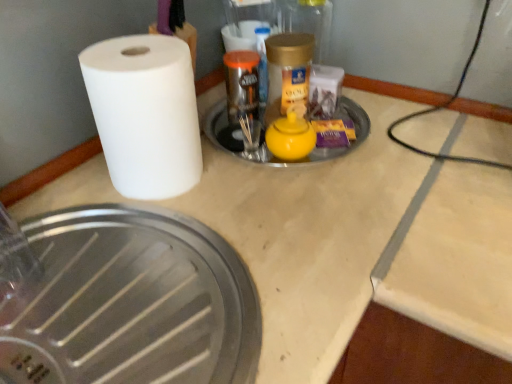
Locate an element on the screen. The width and height of the screenshot is (512, 384). gold metallic jar at upper center is located at coordinates (308, 22).

The height and width of the screenshot is (384, 512). Describe the element at coordinates (125, 301) in the screenshot. I see `brushed metal manhole cover at lower left, the 2th manhole cover viewed from the top` at that location.

Identify the location of white matte paper towel at left. This screenshot has width=512, height=384. (145, 113).

From the image's perspective, who appears lower, white matte paper towel at left or brushed metal manhole cover at lower left, which is counted as the 1th manhole cover, starting from the bottom?

brushed metal manhole cover at lower left, which is counted as the 1th manhole cover, starting from the bottom, is shown below in the image.

Can you confirm if white matte paper towel at left is positioned to the right of brushed metal manhole cover at lower left, which is counted as the 1th manhole cover, starting from the bottom?

Yes, white matte paper towel at left is to the right of brushed metal manhole cover at lower left, which is counted as the 1th manhole cover, starting from the bottom.

In the scene shown: Is white matte paper towel at left not inside brushed metal manhole cover at lower left, which is counted as the 1th manhole cover, starting from the bottom?

That's correct, white matte paper towel at left is outside of brushed metal manhole cover at lower left, which is counted as the 1th manhole cover, starting from the bottom.

Considering the relative sizes of white matte paper towel at left and brushed metal manhole cover at lower left, which is counted as the 1th manhole cover, starting from the bottom, in the image provided, is white matte paper towel at left taller than brushed metal manhole cover at lower left, which is counted as the 1th manhole cover, starting from the bottom,?

Yes.

Is gold metallic jar at upper center positioned beyond the bounds of brushed metal manhole cover at lower left, the 2th manhole cover viewed from the top?

gold metallic jar at upper center lies outside brushed metal manhole cover at lower left, the 2th manhole cover viewed from the top,'s area.

From the image's perspective, is gold metallic jar at upper center under brushed metal manhole cover at lower left, which is counted as the 1th manhole cover, starting from the bottom?

No, from the image's perspective, gold metallic jar at upper center is not beneath brushed metal manhole cover at lower left, which is counted as the 1th manhole cover, starting from the bottom.

Is gold metallic jar at upper center not near brushed metal manhole cover at lower left, the 2th manhole cover viewed from the top?

Actually, gold metallic jar at upper center and brushed metal manhole cover at lower left, the 2th manhole cover viewed from the top, are a little close together.

Based on their positions, is brushed metal manhole cover at lower left, the 2th manhole cover viewed from the top, located to the left or right of yellow matte teapot at center, which appears as the 2th manhole cover when ordered from the bottom?

In the image, brushed metal manhole cover at lower left, the 2th manhole cover viewed from the top, appears on the left side of yellow matte teapot at center, which appears as the 2th manhole cover when ordered from the bottom.

Considering the positions of point (196, 225) and point (232, 131), is point (196, 225) closer or farther from the camera than point (232, 131)?

Point (196, 225).

Can you confirm if brushed metal manhole cover at lower left, which is counted as the 1th manhole cover, starting from the bottom, is thinner than yellow matte teapot at center, which appears as the 2th manhole cover when ordered from the bottom?

No, brushed metal manhole cover at lower left, which is counted as the 1th manhole cover, starting from the bottom, is not thinner than yellow matte teapot at center, which appears as the 2th manhole cover when ordered from the bottom.

Considering the relative sizes of gold metallic jar at upper center and white matte paper towel at left in the image provided, is gold metallic jar at upper center taller than white matte paper towel at left?

No.

Which is closer to the camera, (329,29) or (145,59)?

Point (329,29) appears to be farther away from the viewer than point (145,59).

Based on their positions, is gold metallic jar at upper center located to the left or right of white matte paper towel at left?

Based on their positions, gold metallic jar at upper center is located to the right of white matte paper towel at left.

Considering the positions of objects gold metallic jar at upper center and white matte paper towel at left in the image provided, who is behind, gold metallic jar at upper center or white matte paper towel at left?

gold metallic jar at upper center is more distant.

Is gold metallic jar at upper center inside brushed metal manhole cover at lower left, which is counted as the 1th manhole cover, starting from the bottom?

No, gold metallic jar at upper center is not surrounded by brushed metal manhole cover at lower left, which is counted as the 1th manhole cover, starting from the bottom.

Considering the sizes of objects brushed metal manhole cover at lower left, the 2th manhole cover viewed from the top, and gold metallic jar at upper center in the image provided, who is shorter, brushed metal manhole cover at lower left, the 2th manhole cover viewed from the top, or gold metallic jar at upper center?

Standing shorter between the two is brushed metal manhole cover at lower left, the 2th manhole cover viewed from the top.

Between brushed metal manhole cover at lower left, the 2th manhole cover viewed from the top, and gold metallic jar at upper center, which one has smaller width?

gold metallic jar at upper center.

Does gold metallic jar at upper center touch yellow matte teapot at center, which appears as the 2th manhole cover when ordered from the bottom?

No, gold metallic jar at upper center is not touching yellow matte teapot at center, which appears as the 2th manhole cover when ordered from the bottom.

Is gold metallic jar at upper center located outside yellow matte teapot at center, which appears as the 2th manhole cover when ordered from the bottom?

Absolutely, gold metallic jar at upper center is external to yellow matte teapot at center, which appears as the 2th manhole cover when ordered from the bottom.

Can you confirm if gold metallic jar at upper center is positioned to the left of yellow matte teapot at center, the first manhole cover from the top?

Incorrect, gold metallic jar at upper center is not on the left side of yellow matte teapot at center, the first manhole cover from the top.

Could you measure the distance between gold metallic jar at upper center and yellow matte teapot at center, the first manhole cover from the top?

They are 11.30 inches apart.

Between point (220, 124) and point (112, 89), which one is positioned behind?

The point (220, 124) is farther from the camera.

How many degrees apart are the facing directions of yellow matte teapot at center, the first manhole cover from the top, and white matte paper towel at left?

The angle between the facing direction of yellow matte teapot at center, the first manhole cover from the top, and the facing direction of white matte paper towel at left is 34 degrees.

Is yellow matte teapot at center, which appears as the 2th manhole cover when ordered from the bottom, oriented away from white matte paper towel at left?

yellow matte teapot at center, which appears as the 2th manhole cover when ordered from the bottom, is not turned away from white matte paper towel at left.

From a real-world perspective, which object stands above the other?

white matte paper towel at left is physically above.

From a real-world perspective, count 2nd manhole covers downward from the white matte paper towel at left and point to it. Please provide its 2D coordinates.

[(125, 301)]

You are a GUI agent. You are given a task and a screenshot of the screen. Output one action in this format:
    pyautogui.click(x=<x>, y=<y>)
    Task: Click on the 2nd manhole cover to the left of the gold metallic jar at upper center, counting from the anchor's position
    
    Given the screenshot: What is the action you would take?
    pyautogui.click(x=125, y=301)

Considering their positions, is brushed metal manhole cover at lower left, which is counted as the 1th manhole cover, starting from the bottom, positioned closer to yellow matte teapot at center, which appears as the 2th manhole cover when ordered from the bottom, than gold metallic jar at upper center?

gold metallic jar at upper center.

Looking at the image, which one is located closer to brushed metal manhole cover at lower left, the 2th manhole cover viewed from the top, gold metallic jar at upper center or white matte paper towel at left?

Based on the image, white matte paper towel at left appears to be nearer to brushed metal manhole cover at lower left, the 2th manhole cover viewed from the top.

Estimate the real-world distances between objects in this image. Which object is further from gold metallic jar at upper center, yellow matte teapot at center, which appears as the 2th manhole cover when ordered from the bottom, or brushed metal manhole cover at lower left, the 2th manhole cover viewed from the top?

brushed metal manhole cover at lower left, the 2th manhole cover viewed from the top.

Estimate the real-world distances between objects in this image. Which object is further from yellow matte teapot at center, the first manhole cover from the top, white matte paper towel at left or brushed metal manhole cover at lower left, which is counted as the 1th manhole cover, starting from the bottom?

brushed metal manhole cover at lower left, which is counted as the 1th manhole cover, starting from the bottom, lies further to yellow matte teapot at center, the first manhole cover from the top, than the other object.

Based on their spatial positions, is white matte paper towel at left or yellow matte teapot at center, the first manhole cover from the top, further from gold metallic jar at upper center?

white matte paper towel at left lies further to gold metallic jar at upper center than the other object.

Which object lies further to the anchor point yellow matte teapot at center, the first manhole cover from the top, gold metallic jar at upper center or white matte paper towel at left?

gold metallic jar at upper center is positioned further to the anchor yellow matte teapot at center, the first manhole cover from the top.

Looking at the image, which one is located further to yellow matte teapot at center, the first manhole cover from the top, white matte paper towel at left or gold metallic jar at upper center?

gold metallic jar at upper center is further to yellow matte teapot at center, the first manhole cover from the top.

Looking at the image, which one is located closer to brushed metal manhole cover at lower left, which is counted as the 1th manhole cover, starting from the bottom, yellow matte teapot at center, which appears as the 2th manhole cover when ordered from the bottom, or gold metallic jar at upper center?

Among the two, yellow matte teapot at center, which appears as the 2th manhole cover when ordered from the bottom, is located nearer to brushed metal manhole cover at lower left, which is counted as the 1th manhole cover, starting from the bottom.

You are a GUI agent. You are given a task and a screenshot of the screen. Output one action in this format:
    pyautogui.click(x=<x>, y=<y>)
    Task: Click on the paper towel between yellow matte teapot at center, the first manhole cover from the top, and brushed metal manhole cover at lower left, which is counted as the 1th manhole cover, starting from the bottom, vertically
    
    Given the screenshot: What is the action you would take?
    (145, 113)

This screenshot has width=512, height=384. In order to click on manhole cover between gold metallic jar at upper center and brushed metal manhole cover at lower left, the 2th manhole cover viewed from the top, in the vertical direction in this screenshot , I will do `click(267, 150)`.

Locate an element on the screen. This screenshot has width=512, height=384. paper towel that lies between gold metallic jar at upper center and brushed metal manhole cover at lower left, which is counted as the 1th manhole cover, starting from the bottom, from top to bottom is located at coordinates (145, 113).

Locate an element on the screen. manhole cover between white matte paper towel at left and gold metallic jar at upper center from front to back is located at coordinates (267, 150).